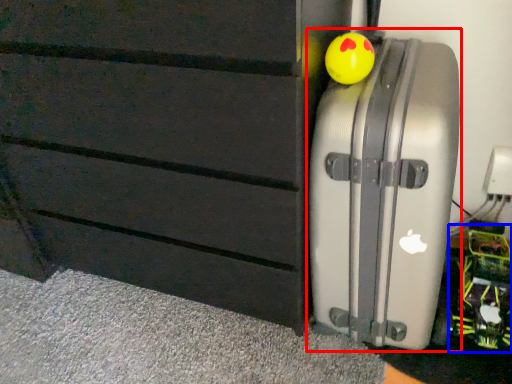
Question: Which of the following is the closest to the observer, suitcase (highlighted by a red box) or toy (highlighted by a blue box)?

Choices:
 (A) suitcase
 (B) toy

Answer: (A)